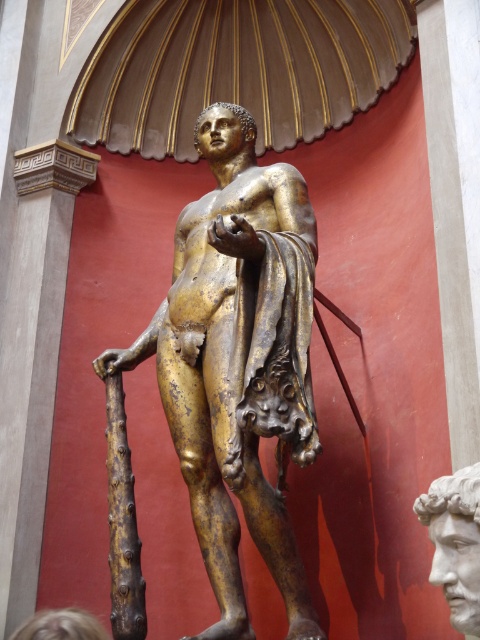
Question: Does gold-bronze statue at center appear under white marble head at center?

Choices:
 (A) no
 (B) yes

Answer: (A)

Question: Among these objects, which one is nearest to the camera?

Choices:
 (A) white marble head at center
 (B) gold-bronze statue at center

Answer: (A)

Question: Does gold-bronze statue at center appear on the left side of white marble head at center?

Choices:
 (A) no
 (B) yes

Answer: (B)

Question: Which point is closer to the camera?

Choices:
 (A) gold-bronze statue at center
 (B) white marble head at center

Answer: (B)

Question: Among these objects, which one is nearest to the camera?

Choices:
 (A) white marble head at center
 (B) gold-bronze statue at center

Answer: (A)

Question: Can you confirm if gold-bronze statue at center is smaller than white marble head at center?

Choices:
 (A) yes
 (B) no

Answer: (B)